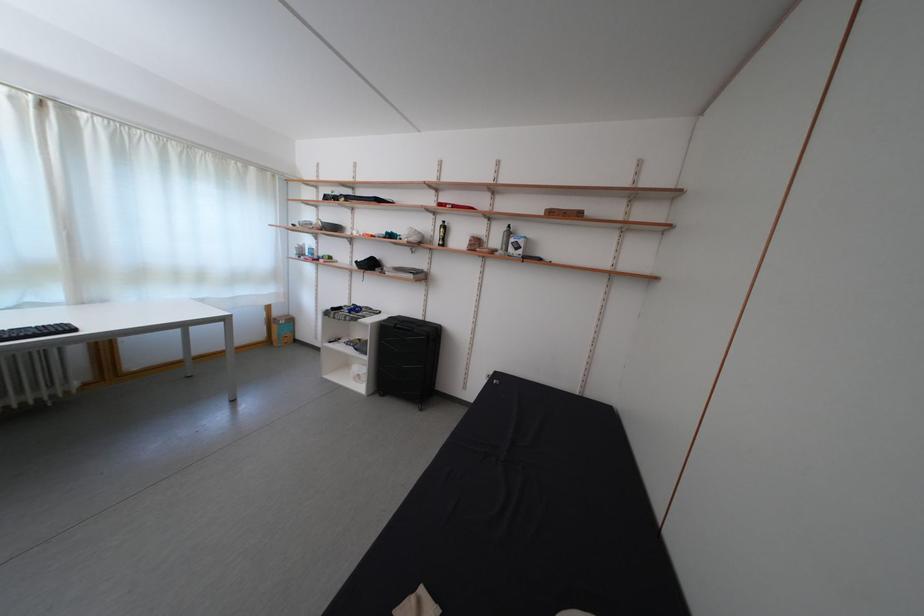
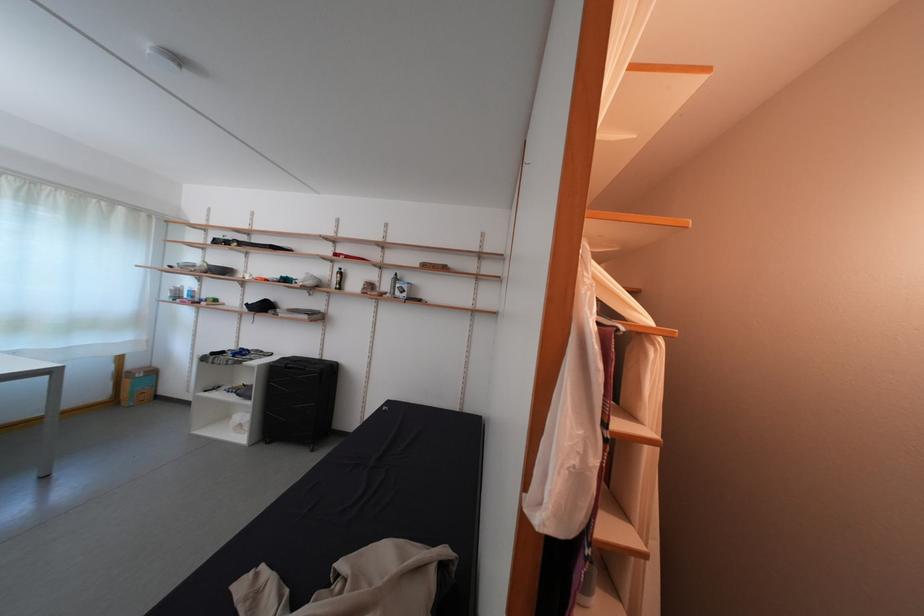
Find the pixel in the second image that matches point (285, 320) in the first image.

(140, 371)